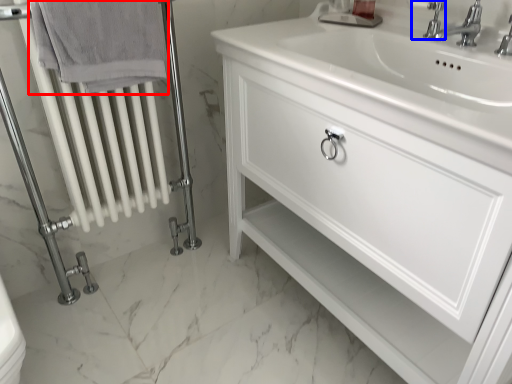
Question: Which point is closer to the camera, bath towel (highlighted by a red box) or plumbing fixture (highlighted by a blue box)?

Choices:
 (A) bath towel
 (B) plumbing fixture

Answer: (A)